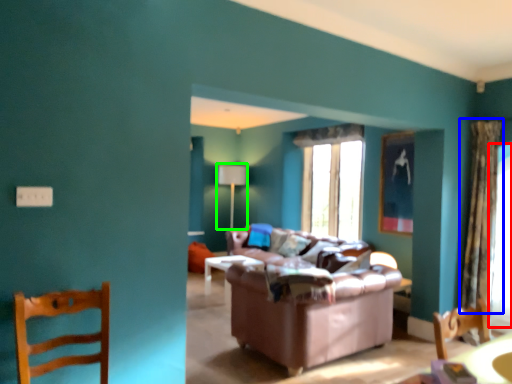
Question: Which object is the farthest from window screen (highlighted by a red box)? Choose among these: curtain (highlighted by a blue box) or lamp (highlighted by a green box).

Choices:
 (A) curtain
 (B) lamp

Answer: (B)